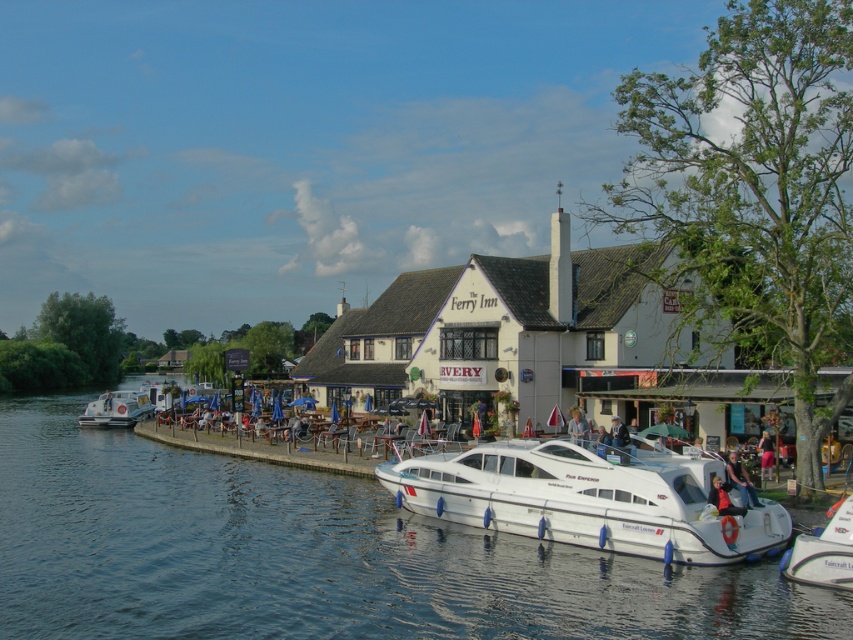
Question: Which object appears farthest from the camera in this image?

Choices:
 (A) white glossy motorboat at center
 (B) light brown wooden chair at center
 (C) blue denim jacket at center
 (D) white glossy houseboat at lower left

Answer: (D)

Question: Does light brown wooden chair at center come behind blue denim jacket at center?

Choices:
 (A) no
 (B) yes

Answer: (A)

Question: Which point is farther to the camera?

Choices:
 (A) blue denim jacket at center
 (B) blue water at lower left
 (C) white glossy houseboat at lower left
 (D) white glossy boat at lower right

Answer: (C)

Question: Which of the following is the closest to the observer?

Choices:
 (A) (131, 401)
 (B) (274, 552)
 (C) (618, 429)

Answer: (B)

Question: Can you confirm if white glossy boat at lower right is thinner than denim jacket at lower right?

Choices:
 (A) yes
 (B) no

Answer: (B)

Question: Where is white glossy boat at lower right located in relation to white glossy houseboat at lower left in the image?

Choices:
 (A) below
 (B) above

Answer: (A)